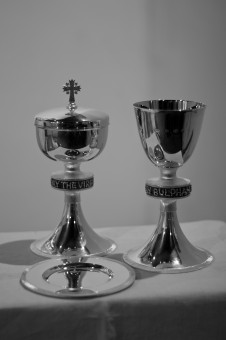
Where is `cup of glass`? This screenshot has width=226, height=340. cup of glass is located at coordinates (170, 134).